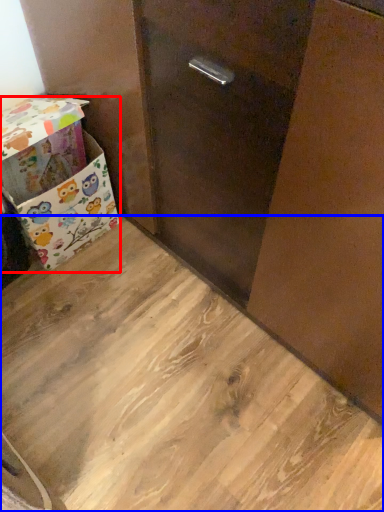
Question: Which object is further to the camera taking this photo, box (highlighted by a red box) or plywood (highlighted by a blue box)?

Choices:
 (A) box
 (B) plywood

Answer: (A)